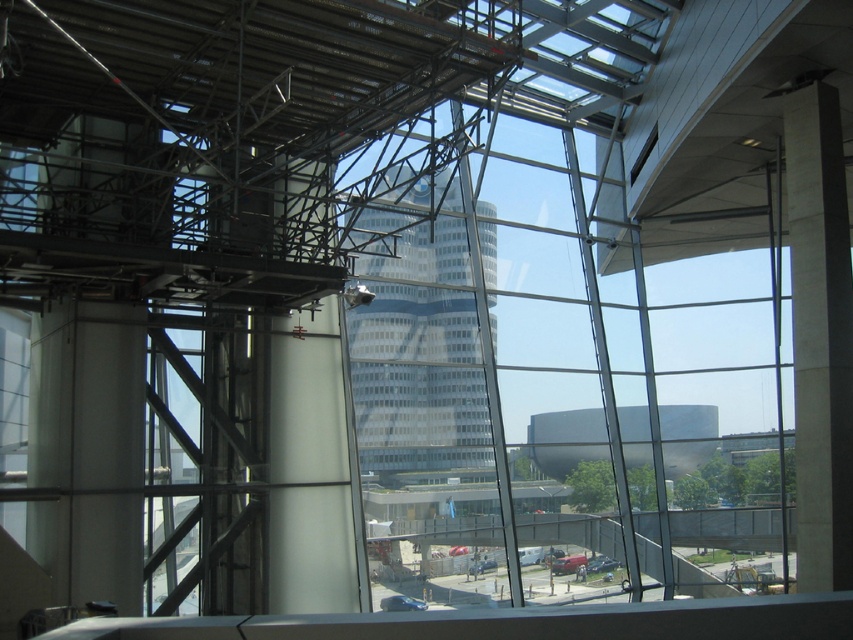
Locate an element on the screen. The image size is (853, 640). white glass tower at center is located at coordinates (419, 346).

How much distance is there between white glass tower at center and smooth concrete pillar at right?

white glass tower at center is 12.31 meters away from smooth concrete pillar at right.

The image size is (853, 640). What do you see at coordinates (419, 346) in the screenshot?
I see `white glass tower at center` at bounding box center [419, 346].

This screenshot has height=640, width=853. Identify the location of white glass tower at center. (419, 346).

Which is in front, point (477, 355) or point (344, 572)?

Point (344, 572)

Which is in front, point (465, 301) or point (309, 566)?

Point (309, 566)

Locate an element on the screen. This screenshot has height=640, width=853. white glass tower at center is located at coordinates (419, 346).

Can you confirm if smooth concrete pillar at right is positioned above white glossy pillar at center-left?

Yes, smooth concrete pillar at right is above white glossy pillar at center-left.

Can you confirm if smooth concrete pillar at right is positioned below white glossy pillar at center-left?

No.

Find the location of a particular element. The width and height of the screenshot is (853, 640). smooth concrete pillar at right is located at coordinates (820, 336).